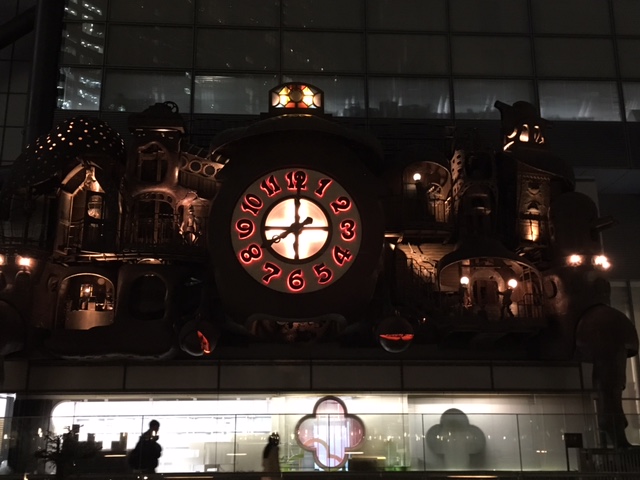
This screenshot has width=640, height=480. I want to click on window, so click(511, 60).